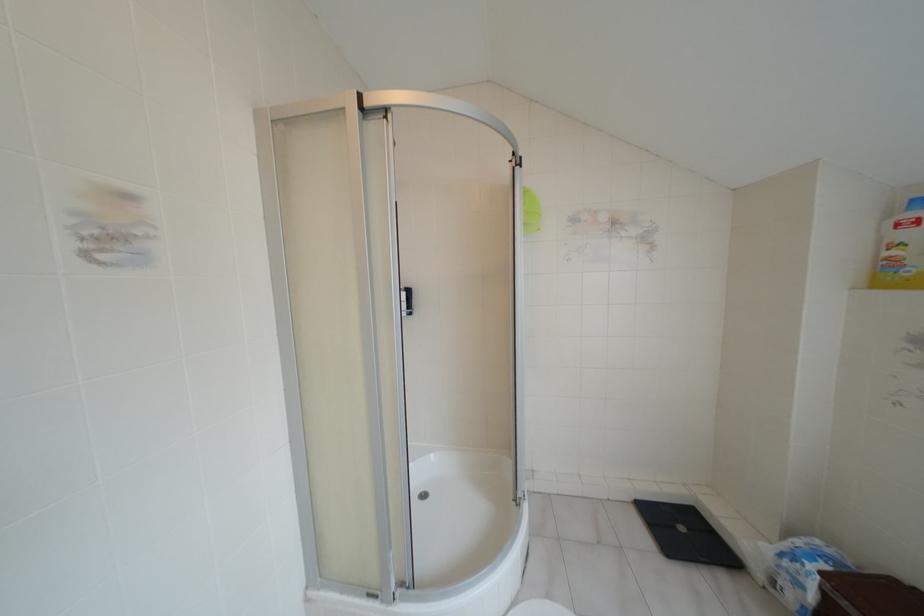
The image size is (924, 616). I want to click on dispenser button, so pyautogui.click(x=405, y=291).